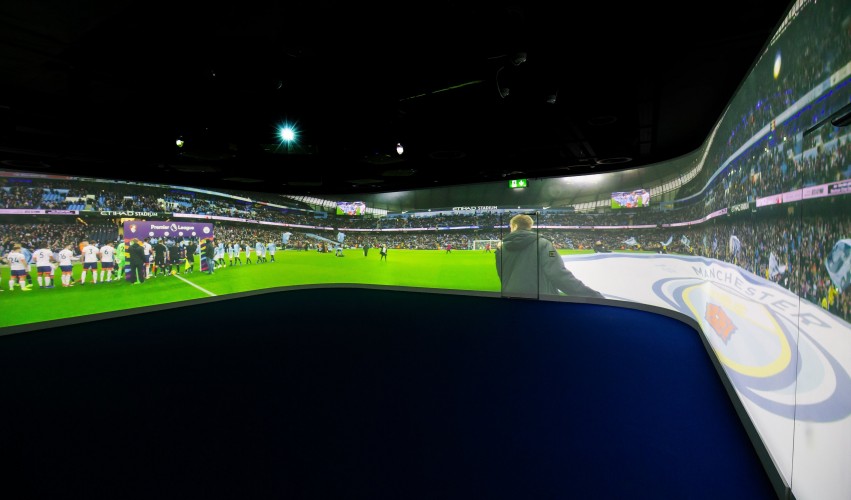
I want to click on giant screens, so point(351,209), point(626,202).